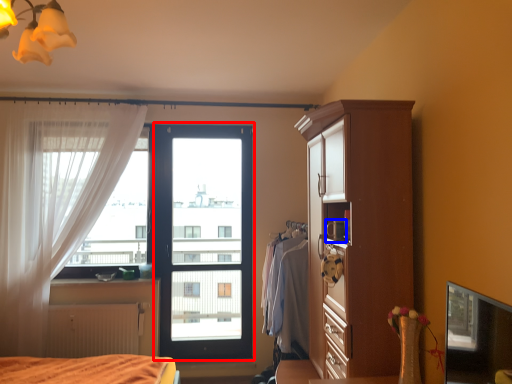
Question: Which object appears farthest to the camera in this image, screen door (highlighted by a red box) or appliance (highlighted by a blue box)?

Choices:
 (A) screen door
 (B) appliance

Answer: (A)